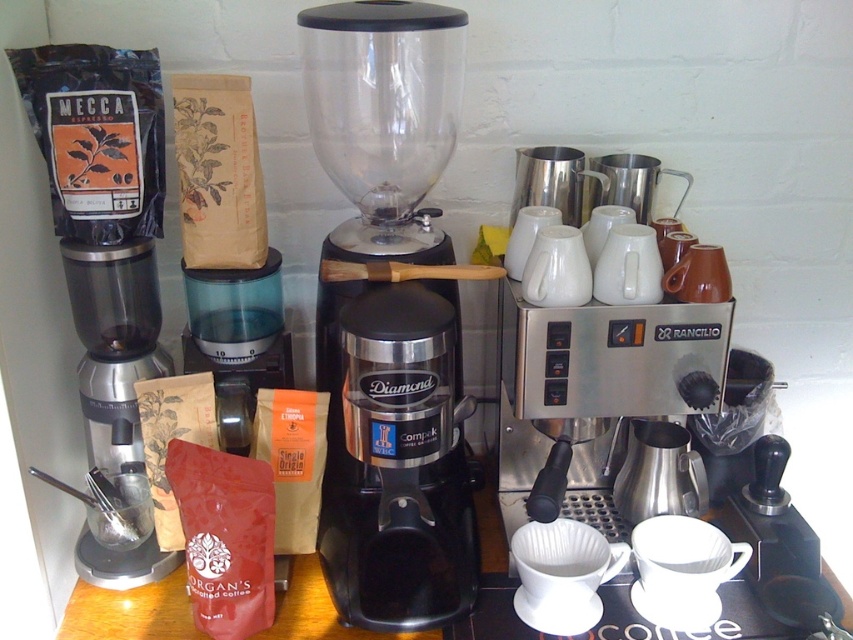
Is point (508, 282) closer to viewer compared to point (149, 310)?

Yes, point (508, 282) is closer to viewer.

Who is more distant from viewer, (561, 508) or (128, 262)?

The point (561, 508) is behind.

What do you see at coordinates (595, 396) in the screenshot? I see `stainless steel espresso machine at center right` at bounding box center [595, 396].

Locate an element on the screen. This screenshot has height=640, width=853. stainless steel espresso machine at center right is located at coordinates (595, 396).

Is black plastic blender at center closer to camera compared to transparent plastic container at center?

Yes, it is in front of transparent plastic container at center.

Between point (335, 148) and point (291, 364), which one is positioned behind?

The point (291, 364) is behind.

Which is in front, point (433, 131) or point (271, 248)?

Point (433, 131)

In order to click on black plastic blender at center in this screenshot , I will do `click(390, 314)`.

Is stainless steel espresso machine at center right further to camera compared to transparent plastic container at center?

No.

Who is positioned more to the right, stainless steel espresso machine at center right or transparent plastic container at center?

Positioned to the right is stainless steel espresso machine at center right.

The width and height of the screenshot is (853, 640). What are the coordinates of `stainless steel espresso machine at center right` in the screenshot? It's located at (595, 396).